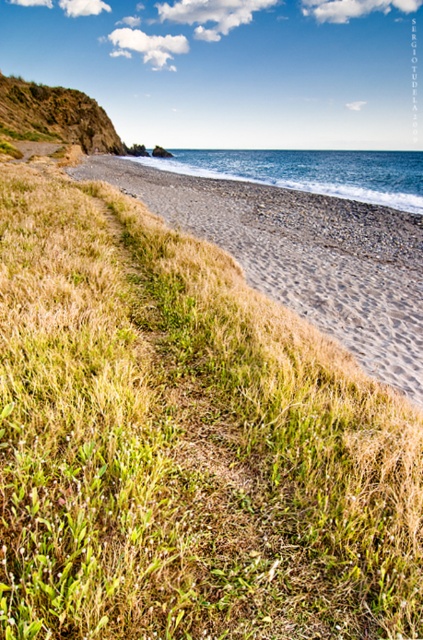
Looking at this image, you are standing at the center of the grassy slope and want to reach the light brown sandy beach at lower right. Which direction should you walk to get there?

You should walk towards the lower right direction to reach the light brown sandy beach at lower right as it is located at point (304, 256).

In the scene shown: You are standing at the base of the green grassy cliff at upper left and want to reach the blue water at beach right. Which direction should you walk to get to the water first?

The blue water at beach right is taller than the green grassy cliff at upper left, so you should walk downhill towards the blue water at beach right to reach it first.

You are standing at the grassy slope and want to walk to the blue water at beach right. Which direction should you go relative to the green grassy cliff at upper left?

The blue water at beach right is above the green grassy cliff at upper left, so you should walk towards the direction away from the green grassy cliff at upper left to reach the blue water at beach right.